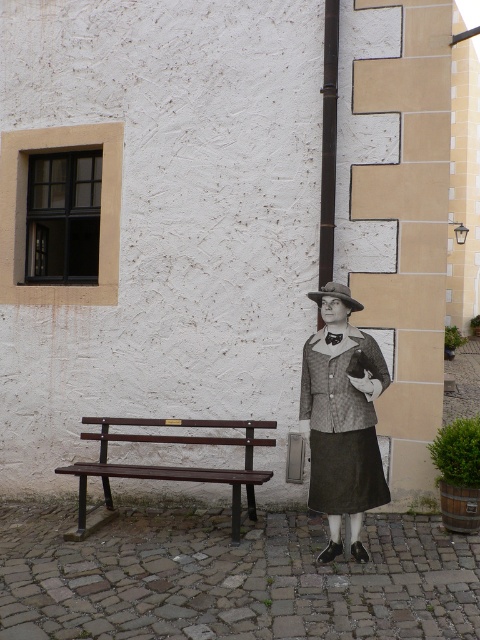
You are a delivery person who needs to place a box on the bench. The box requires 30 inches of space. Can you fit the box between the matte gray fabric coat at center and the brown felt hat at center on the bench?

The distance between the matte gray fabric coat at center and the brown felt hat at center is 25.52 inches. Since the box requires 30 inches of space, it cannot fit between them.

You are a visitor at this outdoor area and see the matte gray fabric coat at center and the wooden bench at lower left. Which object is covering the other?

The matte gray fabric coat at center is positioned over the wooden bench at lower left, so it is covering the bench.

You are a painter who needs to hang a matte gray fabric coat at center and a dark brown wood pole at center on the wall. Based on their sizes, which object should be placed first to ensure they both fit on the wall without overlapping?

The matte gray fabric coat at center might be wider than dark brown wood pole at center, so it should be placed first to ensure both fit without overlapping.